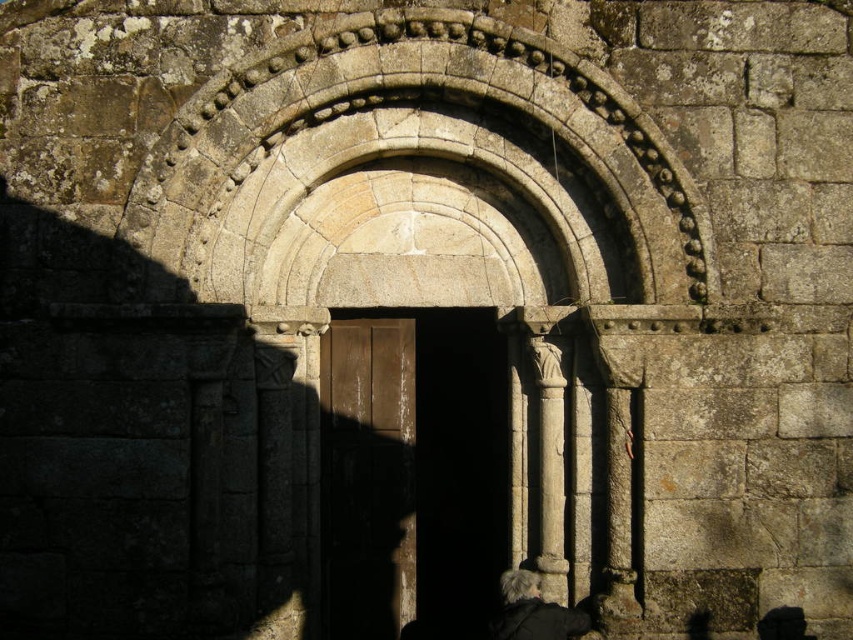
Who is taller, smooth stone column at center or smooth stone pillar at right?

smooth stone column at center

Does smooth stone column at center appear over smooth stone pillar at right?

Yes, smooth stone column at center is above smooth stone pillar at right.

Describe the element at coordinates (550, 468) in the screenshot. I see `smooth stone column at center` at that location.

Where is `smooth stone column at center`? The height and width of the screenshot is (640, 853). smooth stone column at center is located at coordinates (550, 468).

Is point (274, 289) closer to viewer compared to point (523, 632)?

No.

Is stone textured arch at center bigger than dark gray wool coat at lower center?

Indeed, stone textured arch at center has a larger size compared to dark gray wool coat at lower center.

Which is in front, point (624, 294) or point (524, 580)?

Point (624, 294) is more forward.

At what (x,y) coordinates should I click in order to perform the action: click on stone textured arch at center. Please return your answer as a coordinate pair (x, y). This screenshot has height=640, width=853. Looking at the image, I should click on (418, 177).

Does point (405, 589) come in front of point (543, 422)?

No, it is not.

Between point (389, 628) and point (560, 426), which one is positioned in front?

Point (560, 426) is more forward.

Identify the location of brown wooden door at center. The width and height of the screenshot is (853, 640). pos(367,477).